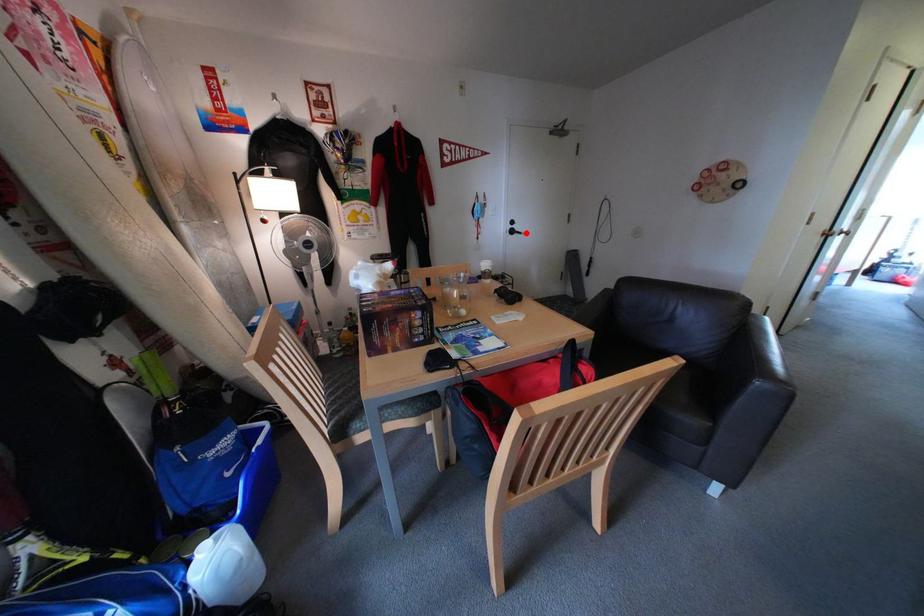
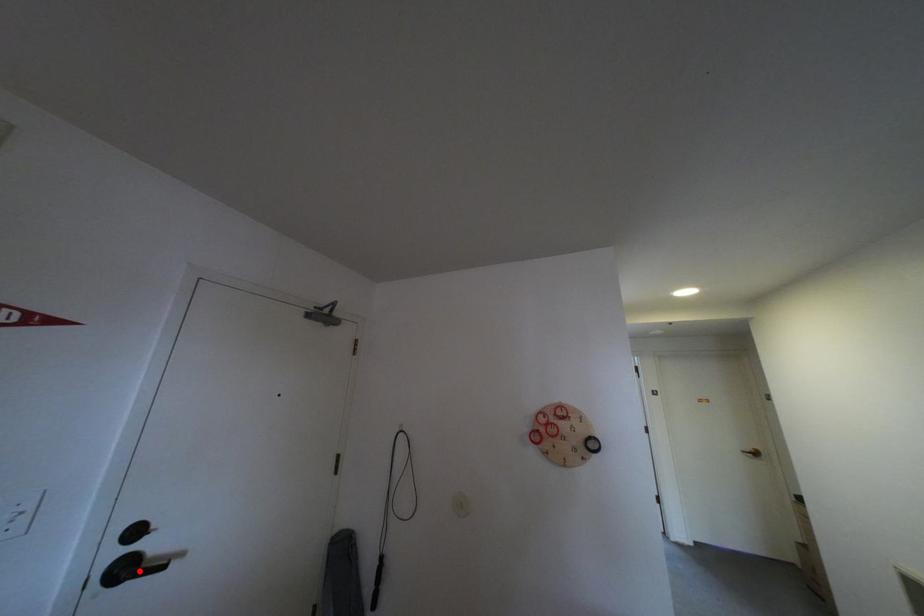
From the picture: I am providing you with two images of the same scene from different viewpoints. A red point is marked on the first image and another point is marked on the second image. Is the red point in image1 aligned with the point shown in image2?

Yes